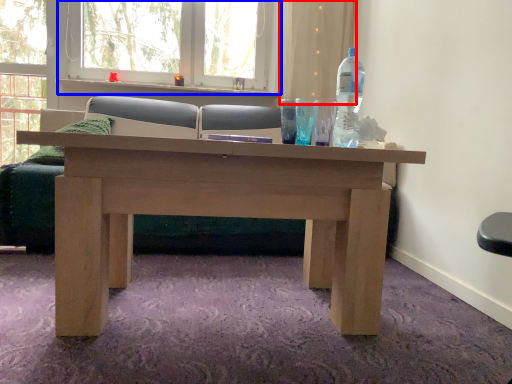
Question: Which of the following is the farthest to the observer, curtain (highlighted by a red box) or window frame (highlighted by a blue box)?

Choices:
 (A) curtain
 (B) window frame

Answer: (A)